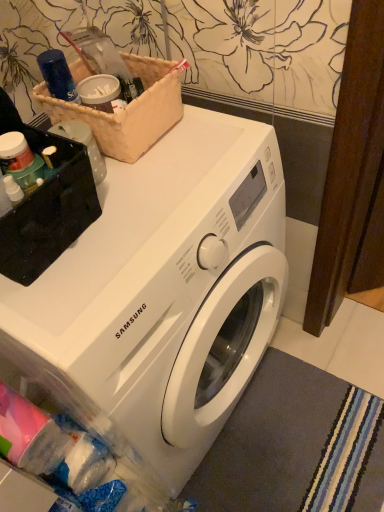
Identify the location of free space in front of brown woven basket at upper left. This screenshot has height=512, width=384. (164, 185).